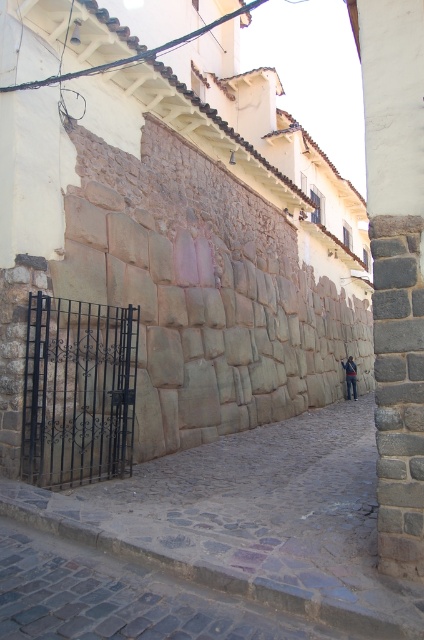
Which is below, gray cobblestone alley at center or blue denim jeans at center?

blue denim jeans at center

Does gray cobblestone alley at center come behind blue denim jeans at center?

No.

Image resolution: width=424 pixels, height=640 pixels. What are the coordinates of `gray cobblestone alley at center` in the screenshot? It's located at (253, 518).

This screenshot has width=424, height=640. In order to click on gray cobblestone alley at center in this screenshot , I will do `click(253, 518)`.